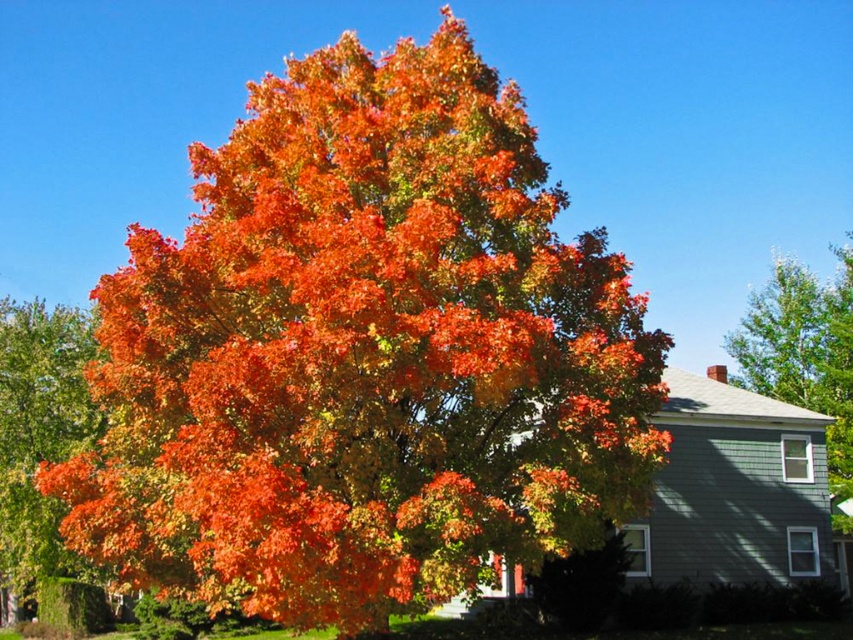
You are planning to take a photo of the orange leafy tree at center and the green leafy tree at upper right. Since you want both trees to be clearly visible in the frame, which tree should you focus on first to ensure proper focus, considering their sizes?

The orange leafy tree at center is larger in size than the green leafy tree at upper right, so you should focus on the orange leafy tree at center first to ensure both are in focus.

You are standing in front of the large tree with autumn leaves and the house in the background. You notice the shiny orange leaves at center and the green leafy tree at upper right. Which object is located to the left of the other?

The shiny orange leaves at center is positioned on the left side of green leafy tree at upper right.

Based on the photo, you are standing in the autumn scene and want to pick up the shiny orange leaves at center. Which object is directly above the green leafy tree at upper right?

The shiny orange leaves at center are directly above the green leafy tree at upper right.